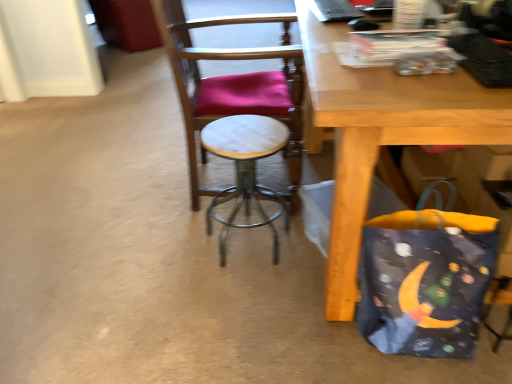
Where is `vacant space to the left of marble seat at center`? The width and height of the screenshot is (512, 384). vacant space to the left of marble seat at center is located at coordinates (126, 203).